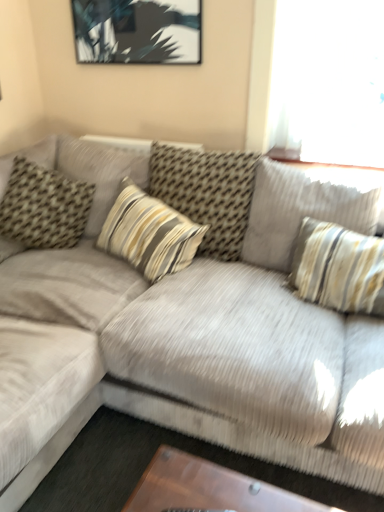
Question: From the image's perspective, does brown textured pillow at left, the 1th pillow from the left, appear higher than striped fabric pillow at center, which ranks as the second pillow in left-to-right order?

Choices:
 (A) no
 (B) yes

Answer: (B)

Question: Is brown textured pillow at left, positioned as the fourth pillow in right-to-left order, at the left side of striped fabric pillow at center, acting as the 3th pillow starting from the right?

Choices:
 (A) no
 (B) yes

Answer: (B)

Question: Is brown textured pillow at left, positioned as the fourth pillow in right-to-left order, far away from striped fabric pillow at center, acting as the 3th pillow starting from the right?

Choices:
 (A) no
 (B) yes

Answer: (A)

Question: Is brown textured pillow at left, positioned as the fourth pillow in right-to-left order, wider than striped fabric pillow at center, which ranks as the second pillow in left-to-right order?

Choices:
 (A) no
 (B) yes

Answer: (A)

Question: From the image's perspective, does brown textured pillow at left, positioned as the fourth pillow in right-to-left order, appear lower than striped fabric pillow at center, acting as the 3th pillow starting from the right?

Choices:
 (A) no
 (B) yes

Answer: (A)

Question: From a real-world perspective, is velvet beige couch at center physically located above or below striped fabric pillow at center, which ranks as the second pillow in left-to-right order?

Choices:
 (A) below
 (B) above

Answer: (A)

Question: From the image's perspective, is velvet beige couch at center located above or below striped fabric pillow at center, acting as the 3th pillow starting from the right?

Choices:
 (A) above
 (B) below

Answer: (B)

Question: Is velvet beige couch at center taller or shorter than striped fabric pillow at center, acting as the 3th pillow starting from the right?

Choices:
 (A) short
 (B) tall

Answer: (B)

Question: Is velvet beige couch at center spatially inside striped fabric pillow at center, which ranks as the second pillow in left-to-right order, or outside of it?

Choices:
 (A) outside
 (B) inside

Answer: (A)

Question: Is striped fabric pillow at center, which is the third pillow in left-to-right order, wider or thinner than velvet beige couch at center?

Choices:
 (A) wide
 (B) thin

Answer: (B)

Question: From the image's perspective, is striped fabric pillow at center, the second pillow in the right-to-left sequence, positioned above or below velvet beige couch at center?

Choices:
 (A) above
 (B) below

Answer: (A)

Question: From a real-world perspective, is striped fabric pillow at center, the second pillow in the right-to-left sequence, positioned above or below velvet beige couch at center?

Choices:
 (A) below
 (B) above

Answer: (B)

Question: Visually, is striped fabric pillow at center, the second pillow in the right-to-left sequence, positioned to the left or to the right of velvet beige couch at center?

Choices:
 (A) right
 (B) left

Answer: (A)

Question: From a real-world perspective, is striped fabric pillow at center, which is the third pillow in left-to-right order, physically located above or below brown textured pillow at left, positioned as the fourth pillow in right-to-left order?

Choices:
 (A) above
 (B) below

Answer: (A)

Question: In terms of size, does striped fabric pillow at center, the second pillow in the right-to-left sequence, appear bigger or smaller than brown textured pillow at left, positioned as the fourth pillow in right-to-left order?

Choices:
 (A) big
 (B) small

Answer: (A)